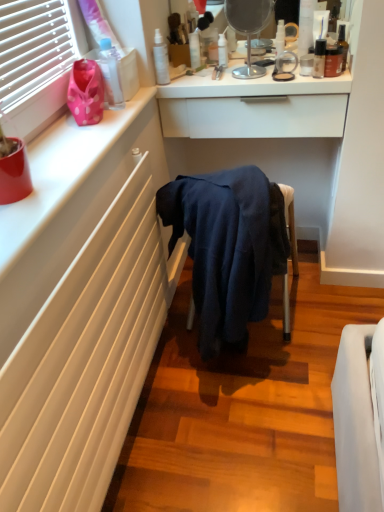
Question: Considering the positions of transparent plastic bottle at upper left, the 8th toiletry positioned from the right, and satin white spray bottle at upper center, the 2th toiletry from the left, in the image, is transparent plastic bottle at upper left, the 8th toiletry positioned from the right, wider or thinner than satin white spray bottle at upper center, the 2th toiletry from the left,?

Choices:
 (A) wide
 (B) thin

Answer: (A)

Question: Visually, is transparent plastic bottle at upper left, which is the first toiletry from left to right, positioned to the left or to the right of satin white spray bottle at upper center, marked as the seventh toiletry in a right-to-left arrangement?

Choices:
 (A) left
 (B) right

Answer: (A)

Question: Estimate the real-world distances between objects in this image. Which object is closer to the metallic silver mirror at upper center?

Choices:
 (A) white matte counter top at upper left
 (B) dark blue fabric at center
 (C) transparent plastic bottle at upper center, arranged as the third toiletry when viewed from the left
 (D) matte brown bottle at upper right, the 2th toiletry positioned from the right
 (E) satin black bottle at upper right, placed as the sixth toiletry when sorted from left to right

Answer: (C)

Question: Estimate the real-world distances between objects in this image. Which object is farther from the satin white spray bottle at upper center, marked as the seventh toiletry in a right-to-left arrangement?

Choices:
 (A) matte brown bottle at upper right, the 2th toiletry positioned from the right
 (B) white matte radiator at lower left
 (C) translucent plastic spray bottle at upper center, arranged as the fourth toiletry when viewed from the left
 (D) dark blue fabric at center
 (E) white glossy drawer at upper center

Answer: (B)